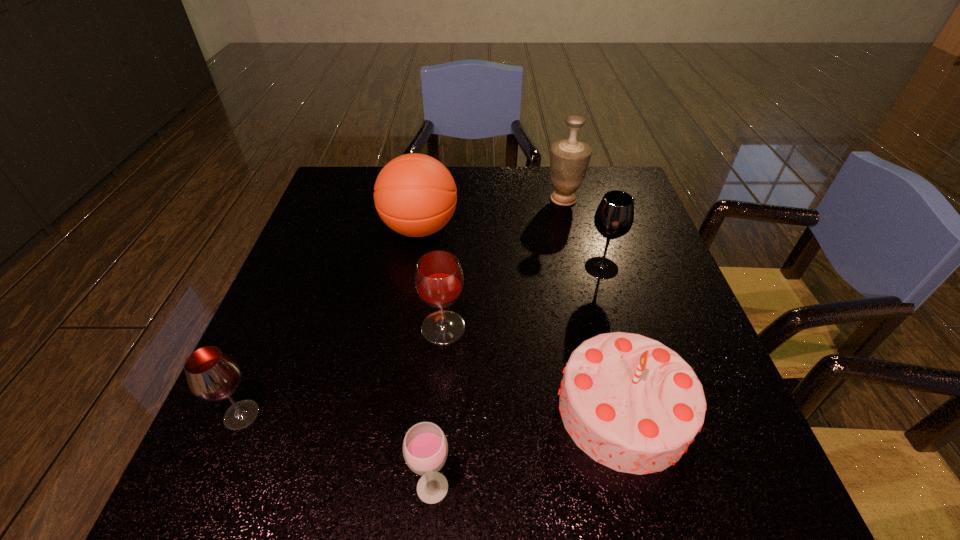
In the image, there is a desktop. At what (x,y) coordinates should I click in order to perform the action: click on blank space at the far right corner. Please return your answer as a coordinate pair (x, y). Looking at the image, I should click on (623, 176).

The height and width of the screenshot is (540, 960). In order to click on vacant point located between the nearest wineglass and the birthday cake in this screenshot , I will do click(528, 448).

Where is `free spot between the basketball and the nearest wineglass`? free spot between the basketball and the nearest wineglass is located at coordinates (426, 358).

Find the location of a particular element. The height and width of the screenshot is (540, 960). free spot between the rightmost wineglass and the urn is located at coordinates (583, 233).

I want to click on empty space that is in between the leftmost object and the birthday cake, so click(433, 413).

You are a GUI agent. You are given a task and a screenshot of the screen. Output one action in this format:
    pyautogui.click(x=<x>, y=<y>)
    Task: Click on the empty location between the urn and the basketball
    This screenshot has height=540, width=960.
    Given the screenshot: What is the action you would take?
    pyautogui.click(x=492, y=214)

You are a GUI agent. You are given a task and a screenshot of the screen. Output one action in this format:
    pyautogui.click(x=<x>, y=<y>)
    Task: Click on the vacant area that lies between the urn and the basketball
    The height and width of the screenshot is (540, 960).
    Given the screenshot: What is the action you would take?
    pyautogui.click(x=492, y=214)

The width and height of the screenshot is (960, 540). I want to click on free space between the second farthest wineglass and the urn, so click(x=503, y=264).

This screenshot has height=540, width=960. Find the location of `vacant area between the fifth nearest object and the second nearest wineglass`. vacant area between the fifth nearest object and the second nearest wineglass is located at coordinates (421, 341).

You are a GUI agent. You are given a task and a screenshot of the screen. Output one action in this format:
    pyautogui.click(x=<x>, y=<y>)
    Task: Click on the vacant space that's between the leftmost wineglass and the nearest wineglass
    Image resolution: width=960 pixels, height=540 pixels.
    Given the screenshot: What is the action you would take?
    pyautogui.click(x=337, y=451)